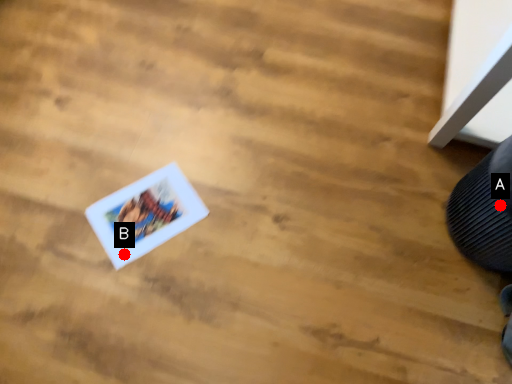
Question: Two points are circled on the image, labeled by A and B beside each circle. Which point is farther from the camera taking this photo?

Choices:
 (A) A is further
 (B) B is further

Answer: (B)